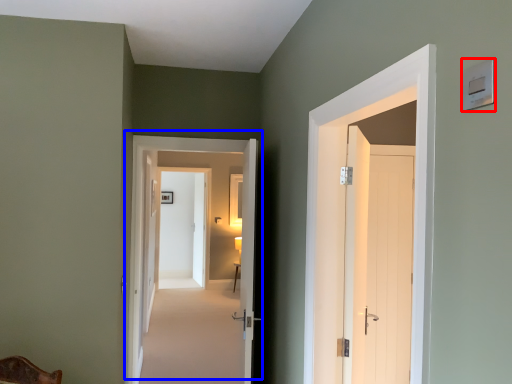
Question: Which object appears farthest to the camera in this image, light switch (highlighted by a red box) or door (highlighted by a blue box)?

Choices:
 (A) light switch
 (B) door

Answer: (B)